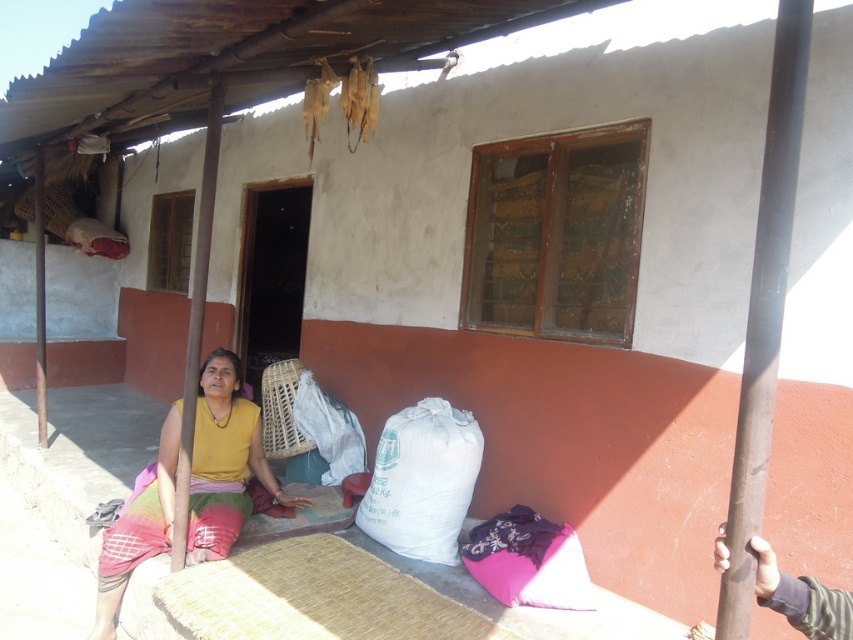
Does brown wooden pole at left appear on the left side of smooth wooden pole at left?

Incorrect, brown wooden pole at left is not on the left side of smooth wooden pole at left.

Which is more to the right, brown wooden pole at left or smooth wooden pole at left?

Positioned to the right is brown wooden pole at left.

Does point (184, 429) come farther from viewer compared to point (35, 248)?

No, (184, 429) is in front of (35, 248).

This screenshot has height=640, width=853. Identify the location of brown wooden pole at left. (195, 324).

Between dark brown wooden pole at right and white fabric sack at lower center, which one is positioned higher?

dark brown wooden pole at right is above.

Does point (750, 492) come farther from viewer compared to point (393, 548)?

No, it is in front of (393, 548).

At what (x,y) coordinates should I click in order to perform the action: click on dark brown wooden pole at right. Please return your answer as a coordinate pair (x, y). This screenshot has height=640, width=853. Looking at the image, I should click on (764, 310).

Image resolution: width=853 pixels, height=640 pixels. What do you see at coordinates (225, 461) in the screenshot?
I see `yellow fabric at center` at bounding box center [225, 461].

Is point (143, 536) more distant than point (521, 570)?

Yes, point (143, 536) is behind point (521, 570).

Who is more forward, (235, 422) or (541, 580)?

Point (541, 580)

Locate an element on the screen. This screenshot has width=853, height=640. yellow fabric at center is located at coordinates (225, 461).